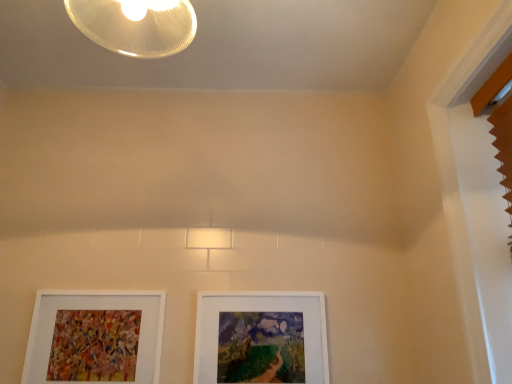
Locate an element on the screen. white matte picture frame at center, marked as the 2th picture frame in a left-to-right arrangement is located at coordinates (261, 338).

This screenshot has height=384, width=512. Describe the element at coordinates (261, 338) in the screenshot. I see `white matte picture frame at center, marked as the 1th picture frame in a right-to-left arrangement` at that location.

What is the approximate width of white matte picture frame at lower left, the second picture frame from the right?

white matte picture frame at lower left, the second picture frame from the right, is 1.80 inches wide.

In order to click on white matte picture frame at lower left, which is counted as the 1th picture frame, starting from the left in this screenshot , I will do `click(97, 337)`.

Describe the element at coordinates (97, 337) in the screenshot. The height and width of the screenshot is (384, 512). I see `white matte picture frame at lower left, which is counted as the 1th picture frame, starting from the left` at that location.

Locate an element on the screen. The width and height of the screenshot is (512, 384). white matte picture frame at center, marked as the 1th picture frame in a right-to-left arrangement is located at coordinates (261, 338).

Would you say white matte picture frame at center, marked as the 1th picture frame in a right-to-left arrangement, is to the left or to the right of white matte picture frame at lower left, the second picture frame from the right, in the picture?

white matte picture frame at center, marked as the 1th picture frame in a right-to-left arrangement, is to the right of white matte picture frame at lower left, the second picture frame from the right.

Is white matte picture frame at center, marked as the 2th picture frame in a left-to-right arrangement, further to camera compared to white matte picture frame at lower left, the second picture frame from the right?

Yes, white matte picture frame at center, marked as the 2th picture frame in a left-to-right arrangement, is further from the viewer.

Between point (264, 359) and point (75, 308), which one is positioned behind?

The point (75, 308) is more distant.

From the image's perspective, does white matte picture frame at center, marked as the 2th picture frame in a left-to-right arrangement, appear lower than white matte picture frame at lower left, which is counted as the 1th picture frame, starting from the left?

Yes, from the image's perspective, white matte picture frame at center, marked as the 2th picture frame in a left-to-right arrangement, is beneath white matte picture frame at lower left, which is counted as the 1th picture frame, starting from the left.

Based on the photo, from a real-world perspective, who is located higher, white matte picture frame at center, marked as the 1th picture frame in a right-to-left arrangement, or white matte picture frame at lower left, the second picture frame from the right?

white matte picture frame at center, marked as the 1th picture frame in a right-to-left arrangement.

Considering the sizes of white matte picture frame at center, marked as the 1th picture frame in a right-to-left arrangement, and white matte picture frame at lower left, the second picture frame from the right, in the image, is white matte picture frame at center, marked as the 1th picture frame in a right-to-left arrangement, wider or thinner than white matte picture frame at lower left, the second picture frame from the right,?

Considering their sizes, white matte picture frame at center, marked as the 1th picture frame in a right-to-left arrangement, looks broader than white matte picture frame at lower left, the second picture frame from the right.

Between white matte picture frame at center, marked as the 1th picture frame in a right-to-left arrangement, and white matte picture frame at lower left, the second picture frame from the right, which one has more height?

white matte picture frame at lower left, the second picture frame from the right.

Can you confirm if white matte picture frame at center, marked as the 2th picture frame in a left-to-right arrangement, is bigger than white matte picture frame at lower left, the second picture frame from the right?

Indeed, white matte picture frame at center, marked as the 2th picture frame in a left-to-right arrangement, has a larger size compared to white matte picture frame at lower left, the second picture frame from the right.

Can white matte picture frame at lower left, the second picture frame from the right, be found inside white matte picture frame at center, marked as the 2th picture frame in a left-to-right arrangement?

Actually, white matte picture frame at lower left, the second picture frame from the right, is outside white matte picture frame at center, marked as the 2th picture frame in a left-to-right arrangement.

Is white matte picture frame at center, marked as the 1th picture frame in a right-to-left arrangement, positioned far away from white matte picture frame at lower left, which is counted as the 1th picture frame, starting from the left?

No, white matte picture frame at center, marked as the 1th picture frame in a right-to-left arrangement, is in close proximity to white matte picture frame at lower left, which is counted as the 1th picture frame, starting from the left.

Is white matte picture frame at center, marked as the 1th picture frame in a right-to-left arrangement, facing towards white matte picture frame at lower left, the second picture frame from the right?

No, white matte picture frame at center, marked as the 1th picture frame in a right-to-left arrangement, does not turn towards white matte picture frame at lower left, the second picture frame from the right.

Measure the distance between white matte picture frame at center, marked as the 2th picture frame in a left-to-right arrangement, and white matte picture frame at lower left, which is counted as the 1th picture frame, starting from the left.

A distance of 15.98 inches exists between white matte picture frame at center, marked as the 2th picture frame in a left-to-right arrangement, and white matte picture frame at lower left, which is counted as the 1th picture frame, starting from the left.

Image resolution: width=512 pixels, height=384 pixels. I want to click on picture frame above the white matte picture frame at lower left, which is counted as the 1th picture frame, starting from the left (from a real-world perspective), so click(x=261, y=338).

Is white matte picture frame at lower left, which is counted as the 1th picture frame, starting from the left, to the right of white matte picture frame at center, marked as the 2th picture frame in a left-to-right arrangement, from the viewer's perspective?

No, white matte picture frame at lower left, which is counted as the 1th picture frame, starting from the left, is not to the right of white matte picture frame at center, marked as the 2th picture frame in a left-to-right arrangement.

Considering the positions of objects white matte picture frame at lower left, which is counted as the 1th picture frame, starting from the left, and white matte picture frame at center, marked as the 1th picture frame in a right-to-left arrangement, in the image provided, who is behind, white matte picture frame at lower left, which is counted as the 1th picture frame, starting from the left, or white matte picture frame at center, marked as the 1th picture frame in a right-to-left arrangement,?

white matte picture frame at center, marked as the 1th picture frame in a right-to-left arrangement, is behind.

Which point is more forward, (75, 339) or (213, 367)?

Positioned in front is point (213, 367).

From the image's perspective, does white matte picture frame at lower left, the second picture frame from the right, appear higher than white matte picture frame at center, marked as the 2th picture frame in a left-to-right arrangement?

Yes.

From a real-world perspective, which object stands above the other?

white matte picture frame at center, marked as the 1th picture frame in a right-to-left arrangement, is physically above.

Which of these two, white matte picture frame at lower left, the second picture frame from the right, or white matte picture frame at center, marked as the 2th picture frame in a left-to-right arrangement, is wider?

With larger width is white matte picture frame at center, marked as the 2th picture frame in a left-to-right arrangement.

Considering the relative sizes of white matte picture frame at lower left, which is counted as the 1th picture frame, starting from the left, and white matte picture frame at center, marked as the 2th picture frame in a left-to-right arrangement, in the image provided, is white matte picture frame at lower left, which is counted as the 1th picture frame, starting from the left, taller than white matte picture frame at center, marked as the 2th picture frame in a left-to-right arrangement,?

Yes, white matte picture frame at lower left, which is counted as the 1th picture frame, starting from the left, is taller than white matte picture frame at center, marked as the 2th picture frame in a left-to-right arrangement.

Can you confirm if white matte picture frame at lower left, the second picture frame from the right, is bigger than white matte picture frame at center, marked as the 2th picture frame in a left-to-right arrangement?

Incorrect, white matte picture frame at lower left, the second picture frame from the right, is not larger than white matte picture frame at center, marked as the 2th picture frame in a left-to-right arrangement.

Can we say white matte picture frame at lower left, the second picture frame from the right, lies outside white matte picture frame at center, marked as the 2th picture frame in a left-to-right arrangement?

Indeed, white matte picture frame at lower left, the second picture frame from the right, is completely outside white matte picture frame at center, marked as the 2th picture frame in a left-to-right arrangement.

Would you consider white matte picture frame at lower left, which is counted as the 1th picture frame, starting from the left, to be distant from white matte picture frame at center, marked as the 1th picture frame in a right-to-left arrangement?

They are positioned close to each other.

Could you tell me if white matte picture frame at lower left, the second picture frame from the right, is turned towards white matte picture frame at center, marked as the 2th picture frame in a left-to-right arrangement?

No, white matte picture frame at lower left, the second picture frame from the right, does not turn towards white matte picture frame at center, marked as the 2th picture frame in a left-to-right arrangement.

How many degrees apart are the facing directions of white matte picture frame at lower left, the second picture frame from the right, and white matte picture frame at center, marked as the 1th picture frame in a right-to-left arrangement?

There is a 1.87-degree angle between the facing directions of white matte picture frame at lower left, the second picture frame from the right, and white matte picture frame at center, marked as the 1th picture frame in a right-to-left arrangement.

The height and width of the screenshot is (384, 512). I want to click on picture frame below the white matte picture frame at lower left, the second picture frame from the right (from the image's perspective), so click(x=261, y=338).

Identify the location of picture frame that appears above the white matte picture frame at lower left, the second picture frame from the right (from a real-world perspective). (261, 338).

In the image, there is a white matte picture frame at center, marked as the 1th picture frame in a right-to-left arrangement. At what (x,y) coordinates should I click in order to perform the action: click on picture frame above it (from the image's perspective). Please return your answer as a coordinate pair (x, y). This screenshot has width=512, height=384. Looking at the image, I should click on (97, 337).